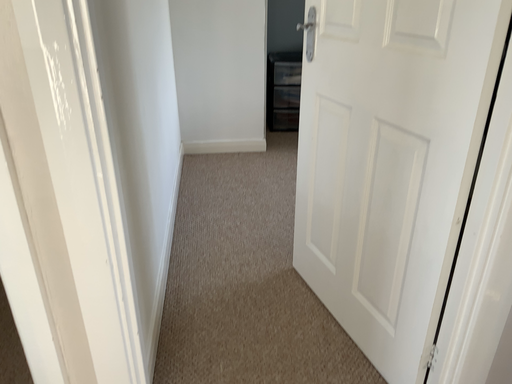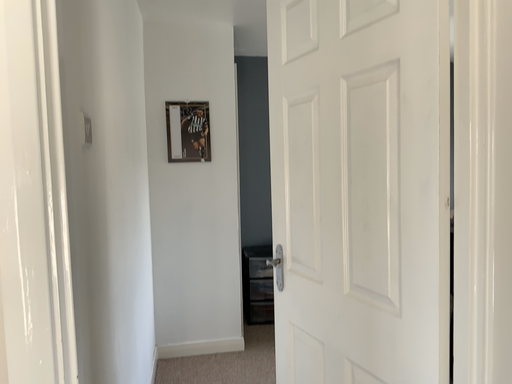
Question: How did the camera likely rotate when shooting the video?

Choices:
 (A) rotated downward
 (B) rotated upward

Answer: (B)